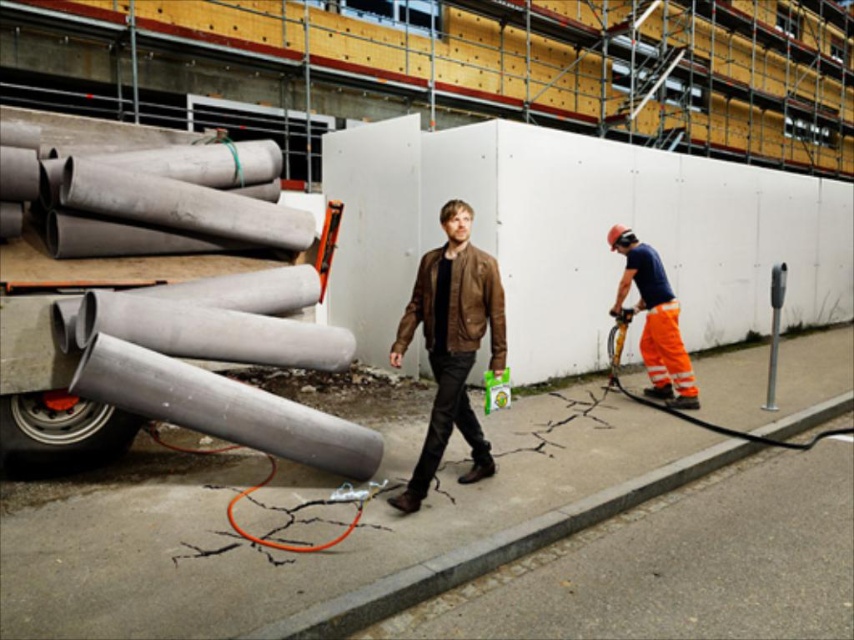
Question: Among these points, which one is nearest to the camera?

Choices:
 (A) (648, 310)
 (B) (447, 298)

Answer: (B)

Question: Which point is farther to the camera?

Choices:
 (A) brown leather jacket at center
 (B) orange reflective pants at right

Answer: (B)

Question: Which object is closer to the camera taking this photo?

Choices:
 (A) brown leather jacket at center
 (B) orange reflective pants at right

Answer: (A)

Question: Does brown leather jacket at center have a larger size compared to orange reflective pants at right?

Choices:
 (A) no
 (B) yes

Answer: (A)

Question: Can you confirm if brown leather jacket at center is thinner than orange reflective pants at right?

Choices:
 (A) yes
 (B) no

Answer: (A)

Question: Does brown leather jacket at center appear under orange reflective pants at right?

Choices:
 (A) no
 (B) yes

Answer: (B)